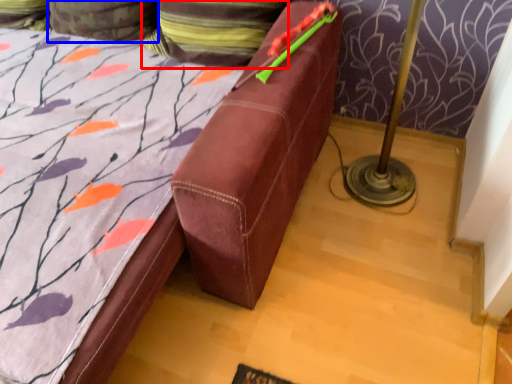
Question: Which object is closer to the camera taking this photo, pillow (highlighted by a red box) or pillow (highlighted by a blue box)?

Choices:
 (A) pillow
 (B) pillow

Answer: (A)